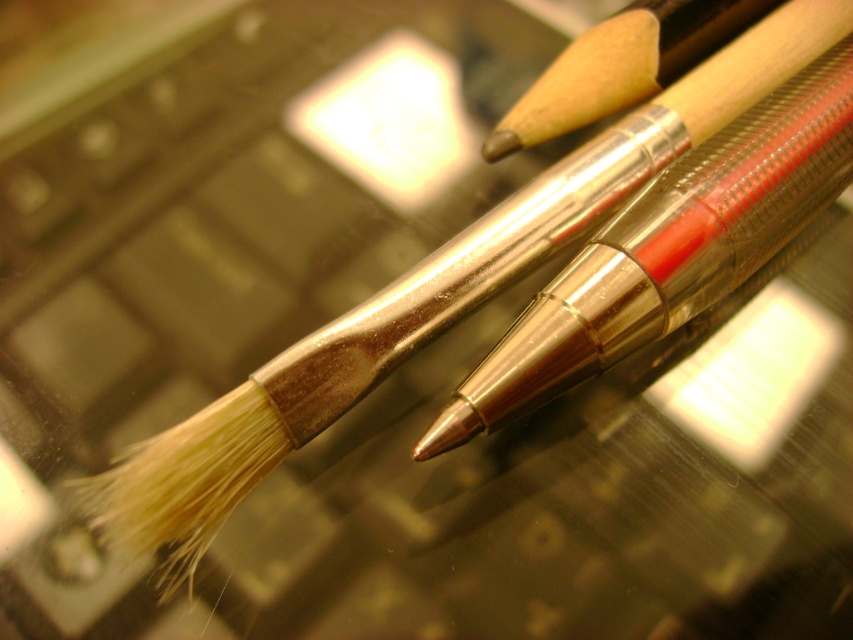
Can you confirm if matte metallic paint brush at center is positioned to the right of wooden paint brush at upper right?

Indeed, matte metallic paint brush at center is positioned on the right side of wooden paint brush at upper right.

Can you confirm if matte metallic paint brush at center is thinner than wooden paint brush at upper right?

Incorrect, matte metallic paint brush at center's width is not less than wooden paint brush at upper right's.

The width and height of the screenshot is (853, 640). What are the coordinates of `matte metallic paint brush at center` in the screenshot? It's located at (670, 250).

Find the location of a particular element. matte metallic paint brush at center is located at coordinates (670, 250).